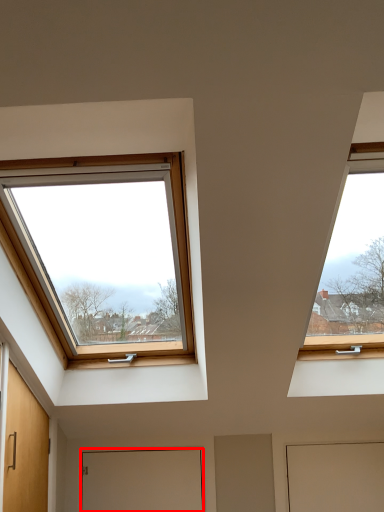
Question: From the image's perspective, where is door (annotated by the red box) located in relation to door in the image?

Choices:
 (A) below
 (B) above

Answer: (A)